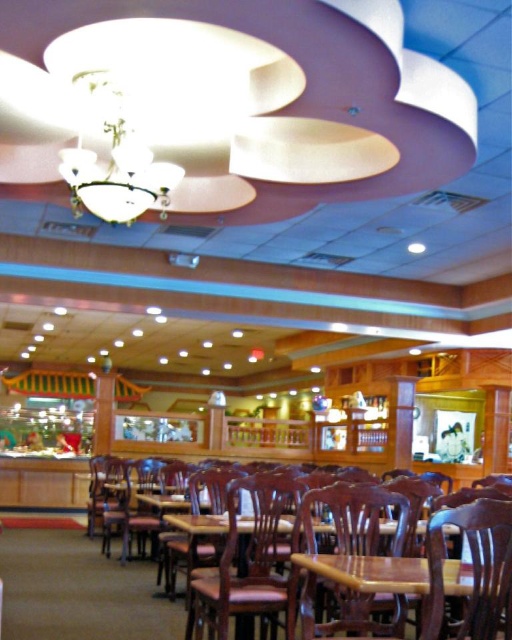
Based on the photo, you are standing in the restaurant and want to place a small decorative item between the two points, point 1 at point (499, 502) and point 2 at point (159, 576). Which point should you stand closer to when placing the item to ensure it appears centered from your viewpoint?

You should stand closer to point 1 at point (499, 502) because it is closer to the viewer than point 2 at point (159, 576). This ensures the decorative item will appear centered from your perspective.

You are a restaurant server carrying a tray of dishes. You need to move from the kitchen entrance to the wooden chair at center without bumping into the brown wood chair at center. Is there enough space between them to navigate safely?

The distance between the wooden chair at center and the brown wood chair at center is 17.89 inches. Since the average tray width is about 12 to 14 inches, there is sufficient space to navigate safely between them without bumping into either chair.

You are a server in a restaurant and need to carry a tray from the wooden chair at lower right to the mahogany wood chair at center. The tray is 2 meters long. Can you safely carry it without hitting anything? Please explain your reasoning.

The distance between the wooden chair at lower right and the mahogany wood chair at center is 6.45 meters. Since the tray is 2 meters long, you can safely carry it as the distance allows enough space to maneuver without obstruction.